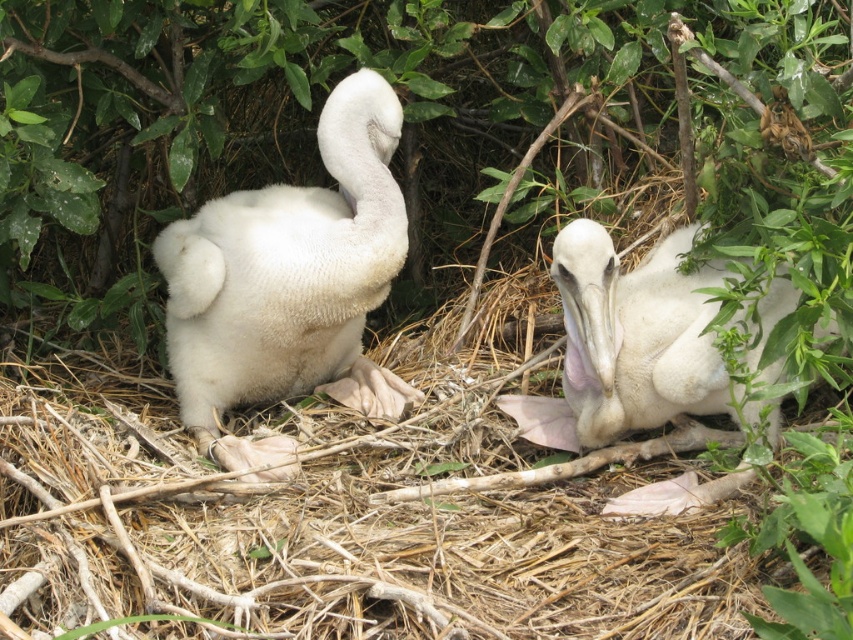
You are observing two young pelicans in their nest. The scene shows a white fluffy bird at left and a white fluffy bird at center. Which of these two birds is positioned more to the left side of the nest?

The white fluffy bird at left is positioned more to the left side of the nest compared to the white fluffy bird at center.